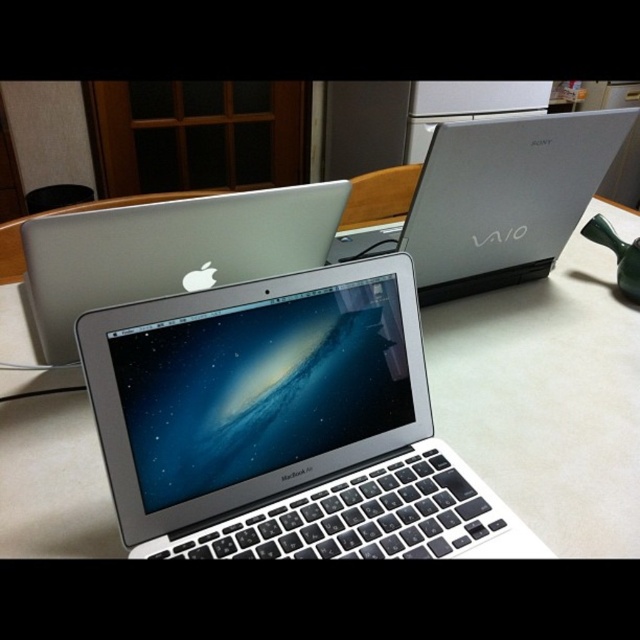
Question: Considering the real-world distances, which object is closest to the sleek silver laptop at center?

Choices:
 (A) white glossy table at center
 (B) satin silver laptop at center

Answer: (A)

Question: Is white glossy table at center above sleek silver laptop at center?

Choices:
 (A) yes
 (B) no

Answer: (B)

Question: Which point is closer to the camera?

Choices:
 (A) satin silver laptop at center
 (B) sleek silver laptop at center

Answer: (A)

Question: Is sleek silver laptop at center to the right of satin silver laptop at center from the viewer's perspective?

Choices:
 (A) yes
 (B) no

Answer: (A)

Question: Can you confirm if white glossy table at center is wider than sleek silver laptop at center?

Choices:
 (A) yes
 (B) no

Answer: (A)

Question: Which of the following is the farthest from the observer?

Choices:
 (A) (56, 227)
 (B) (520, 241)

Answer: (B)